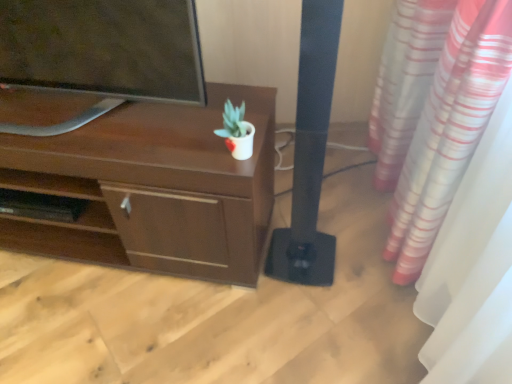
The height and width of the screenshot is (384, 512). Find the location of `spots to the right of black matte speaker at center`. spots to the right of black matte speaker at center is located at coordinates (360, 254).